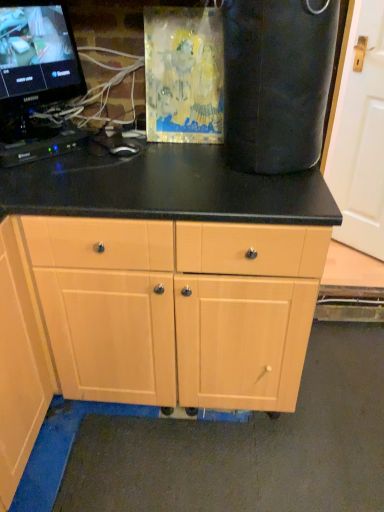
Question: In the image, is light wood cabinet at center positioned in front of or behind black plastic keyboard at left?

Choices:
 (A) behind
 (B) front

Answer: (B)

Question: From the image's perspective, is light wood cabinet at center located above or below black plastic keyboard at left?

Choices:
 (A) below
 (B) above

Answer: (A)

Question: Which of these objects is positioned farthest from the light wood cabinet at center?

Choices:
 (A) white matte door at right
 (B) black glossy monitor at upper left
 (C) black plastic keyboard at left

Answer: (A)

Question: Which object is positioned farthest from the white matte door at right?

Choices:
 (A) black glossy monitor at upper left
 (B) black plastic keyboard at left
 (C) light wood cabinet at center

Answer: (C)